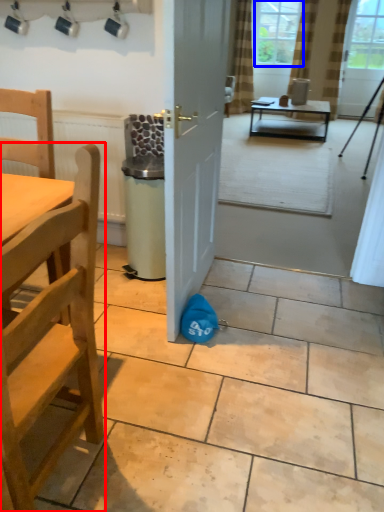
Question: Which of the following is the closest to the observer, chair (highlighted by a red box) or window screen (highlighted by a blue box)?

Choices:
 (A) chair
 (B) window screen

Answer: (A)